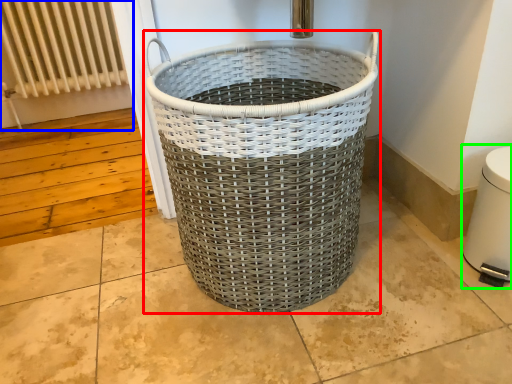
Question: Based on their relative distances, which object is farther from waste container (highlighted by a red box)? Choose from radiator (highlighted by a blue box) and water heater (highlighted by a green box).

Choices:
 (A) radiator
 (B) water heater

Answer: (A)